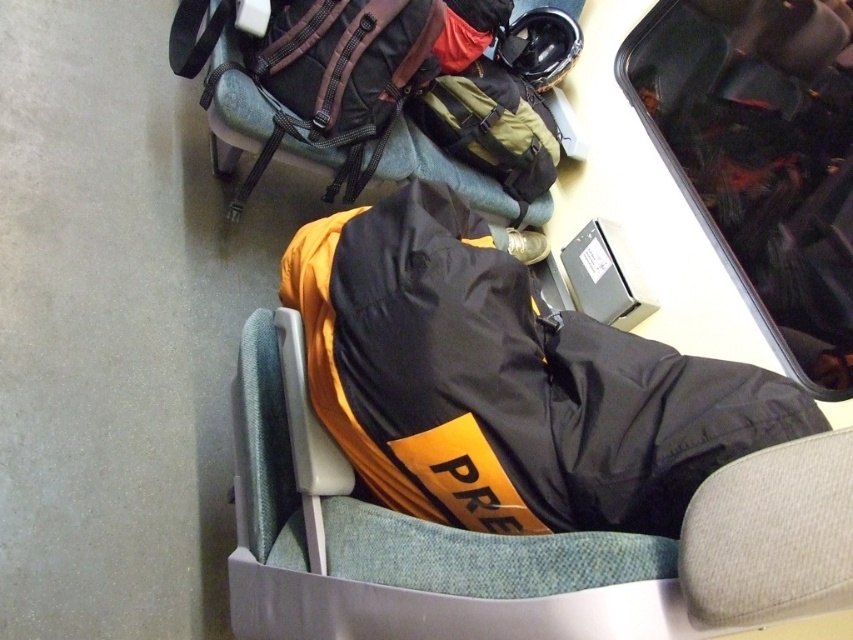
You are a passenger on a train and see both the black matte jacket at center and the black fabric jacket at center. Which jacket is closer to you?

The black matte jacket at center is closer to you because it is located above the black fabric jacket at center, meaning it is in a higher position relative to your viewpoint.

You are a passenger sitting in the train seat. You want to place your backpack on the seat where the black matte jacket at center is located. Is there enough space to place your backpack without moving the jacket?

The black matte jacket at center is located at point [508,381], so there is enough space to place your backpack without moving the jacket.